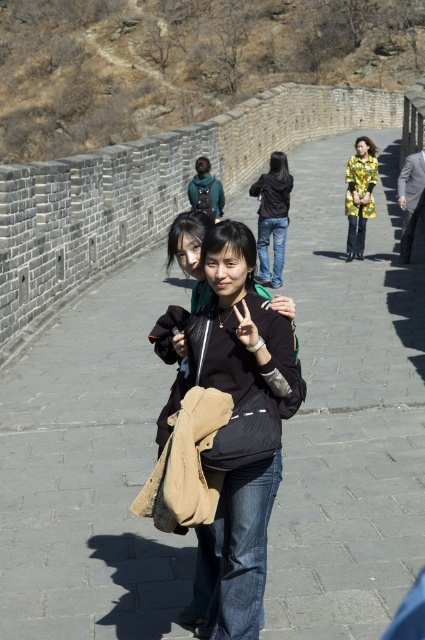
Who is lower down, black matte jacket at center or yellow metallic jacket at center?

Positioned lower is black matte jacket at center.

Who is positioned more to the left, black matte jacket at center or yellow metallic jacket at center?

From the viewer's perspective, black matte jacket at center appears more on the left side.

Find the location of a particular element. The image size is (425, 640). black matte jacket at center is located at coordinates (235, 312).

Does black denim jeans at center have a lesser width compared to yellow metallic jacket at center?

Incorrect, black denim jeans at center's width is not less than yellow metallic jacket at center's.

Based on the photo, does black denim jeans at center have a larger size compared to yellow metallic jacket at center?

Yes, black denim jeans at center is bigger than yellow metallic jacket at center.

What do you see at coordinates (272, 216) in the screenshot? The image size is (425, 640). I see `black denim jeans at center` at bounding box center [272, 216].

Image resolution: width=425 pixels, height=640 pixels. I want to click on black denim jeans at center, so click(272, 216).

Between black matte jacket at center and black denim jeans at center, which one appears on the left side from the viewer's perspective?

From the viewer's perspective, black matte jacket at center appears more on the left side.

Which is above, black matte jacket at center or black denim jeans at center?

black denim jeans at center is higher up.

Who is more forward, (243, 596) or (286, 205)?

Point (243, 596) is in front.

Image resolution: width=425 pixels, height=640 pixels. I want to click on black matte jacket at center, so click(235, 312).